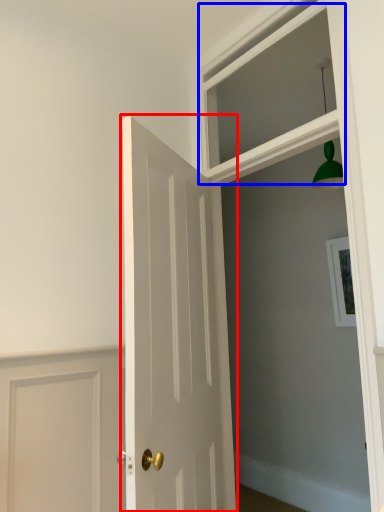
Question: Which point is further to the camera, door (highlighted by a red box) or window (highlighted by a blue box)?

Choices:
 (A) door
 (B) window

Answer: (B)